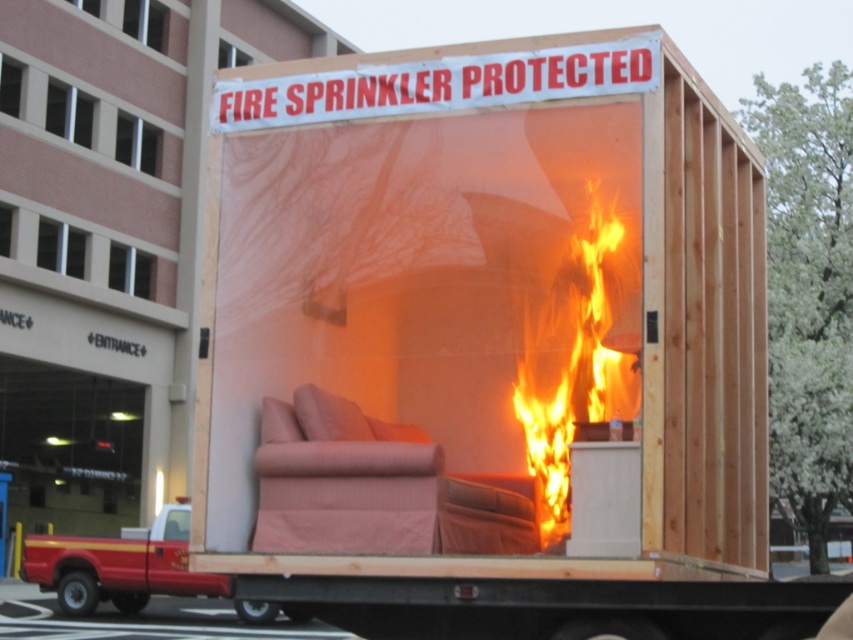
Question: Which of the following is the closest to the observer?

Choices:
 (A) (587, 321)
 (B) (293, 433)

Answer: (B)

Question: Which point appears closest to the camera in this image?

Choices:
 (A) (262, 528)
 (B) (553, 413)

Answer: (A)

Question: Can you confirm if pink fabric couch at center is smaller than flaming orange fabric at center?

Choices:
 (A) yes
 (B) no

Answer: (A)

Question: Is pink fabric couch at center to the right of flaming orange fabric at center from the viewer's perspective?

Choices:
 (A) yes
 (B) no

Answer: (B)

Question: Does pink fabric couch at center appear on the left side of flaming orange fabric at center?

Choices:
 (A) yes
 (B) no

Answer: (A)